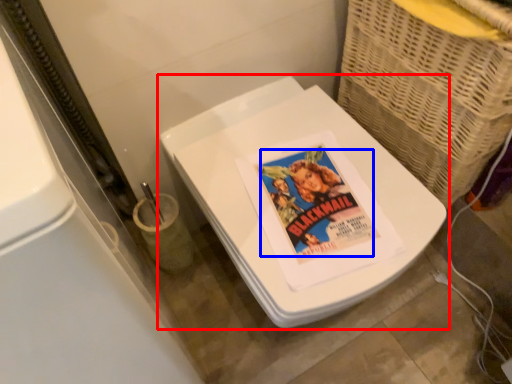
Question: Which object is further to the camera taking this photo, toilet (highlighted by a red box) or comic book character (highlighted by a blue box)?

Choices:
 (A) toilet
 (B) comic book character

Answer: (B)